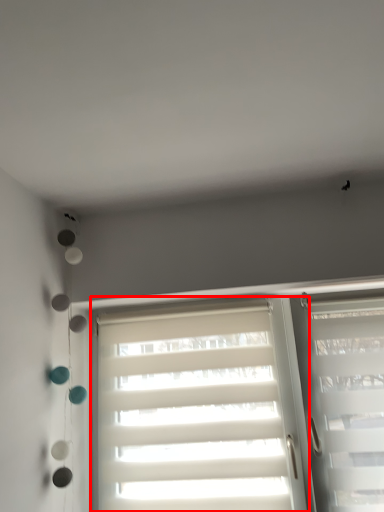
Question: From the image's perspective, where is window (annotated by the red box) located in relation to window in the image?

Choices:
 (A) above
 (B) below

Answer: (B)